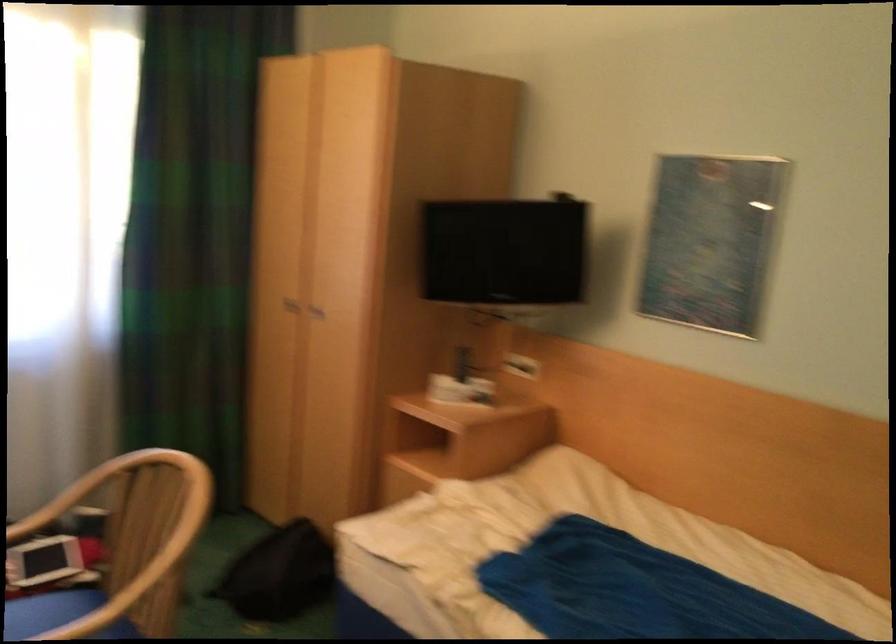
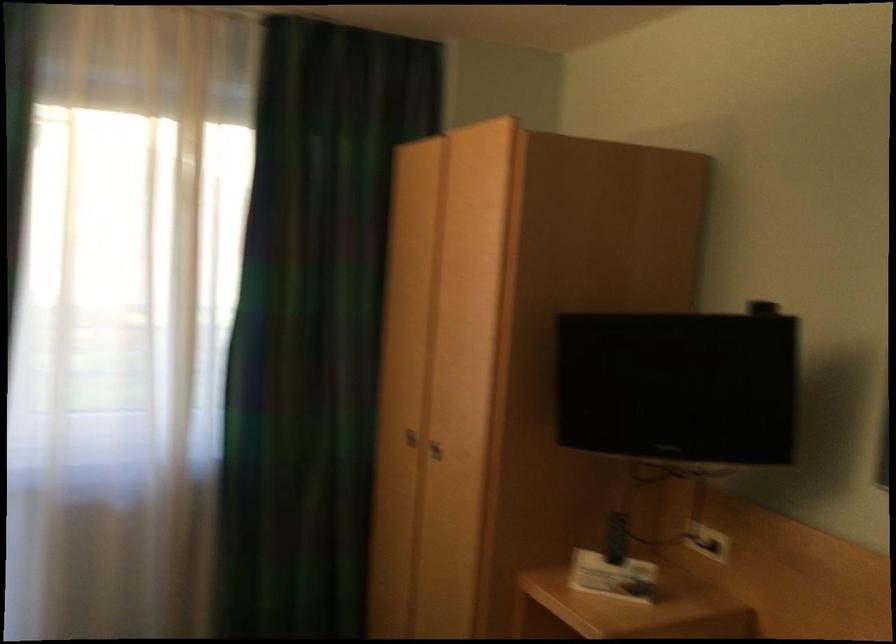
Where in the second image is the point corresponding to (461,389) from the first image?

(613, 576)